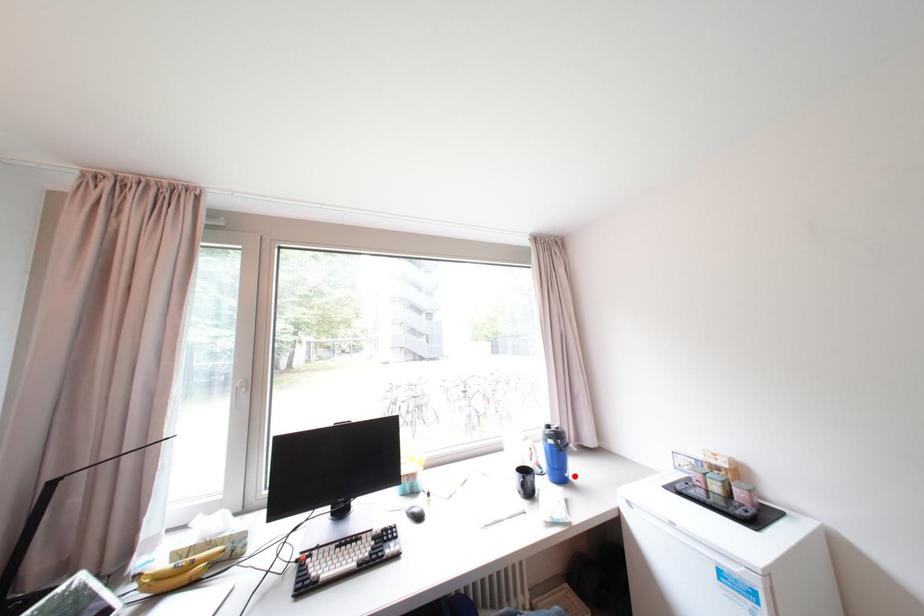
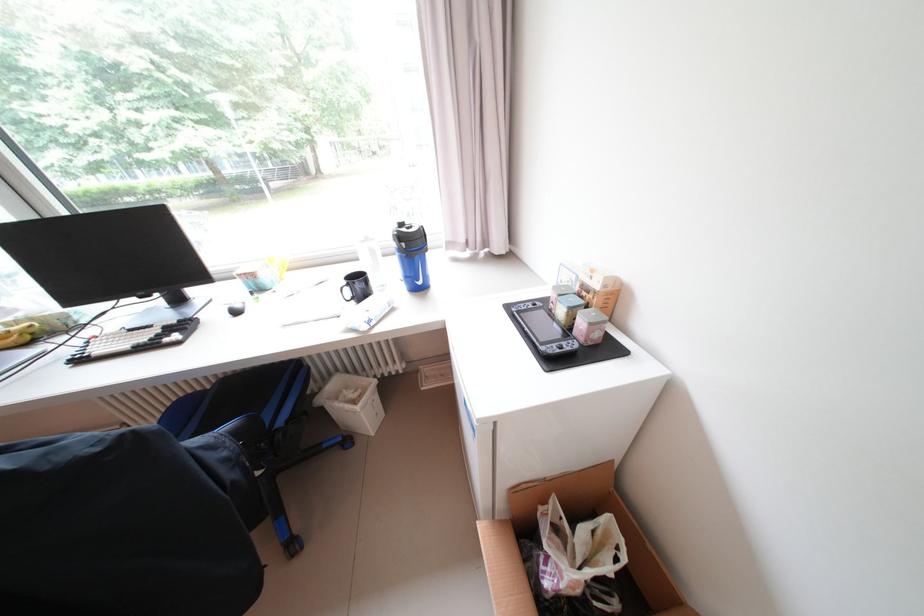
Question: A red point is marked in image1. In image2, is the corresponding 3D point closer to the camera or farther? Reply with the corresponding letter.

Choices:
 (A) The corresponding 3D point is closer.
 (B) The corresponding 3D point is farther.

Answer: (A)